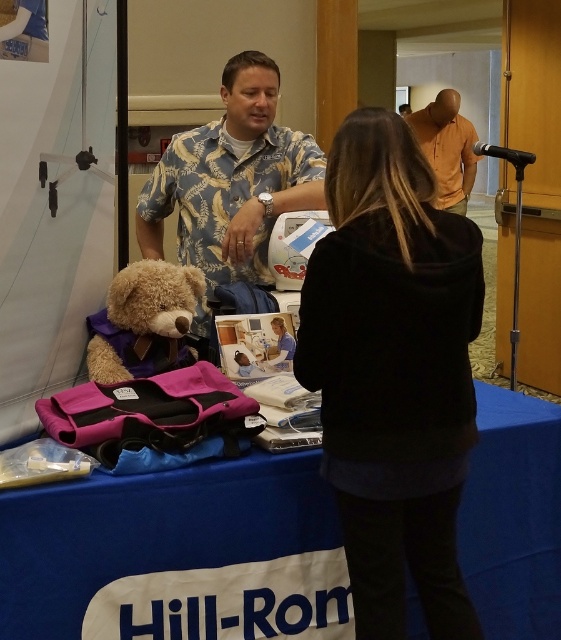
You are attending a trade show and want to locate the blue fabric table at lower center and the black fleece jacket at center. According to the scene, which object is positioned to the left?

The blue fabric table at lower center is to the left of the black fleece jacket at center.

You are standing at the trade show booth looking at the table. There are two points marked on the table surface. The first point is at coordinates point (465, 456) and the second is at point (168, 321). Which point is closer to you?

Point (465, 456) is closer to the viewer than point (168, 321).

You are at a trade show booth and need to place a large promotional banner on the table. Given that the banner is as big as the blue fabric table at lower center, will it also fit over the black fleece jacket at center?

The blue fabric table at lower center is larger in size than the black fleece jacket at center, so a banner the size of the table would also fit over the black fleece jacket at center since it is smaller.